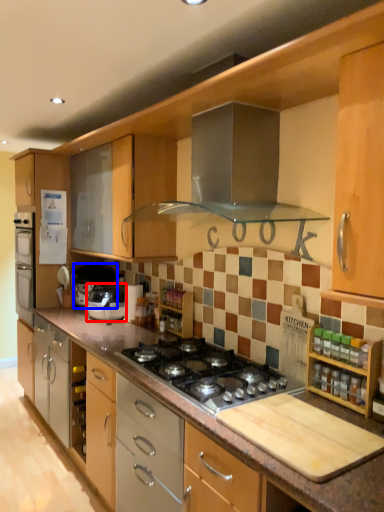
Question: Which object appears farthest to the camera in this image, home appliance (highlighted by a red box) or appliance (highlighted by a blue box)?

Choices:
 (A) home appliance
 (B) appliance

Answer: (B)